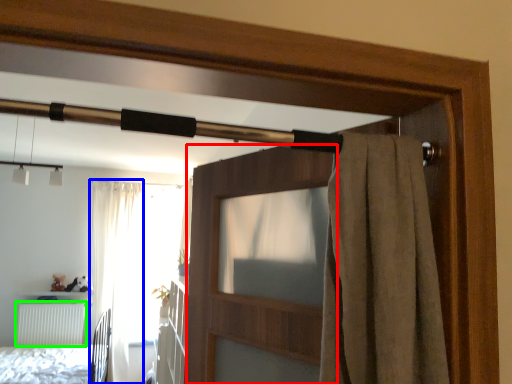
Question: Which is farther away from screen door (highlighted by a red box)? curtain (highlighted by a blue box) or radiator (highlighted by a green box)?

Choices:
 (A) curtain
 (B) radiator

Answer: (B)